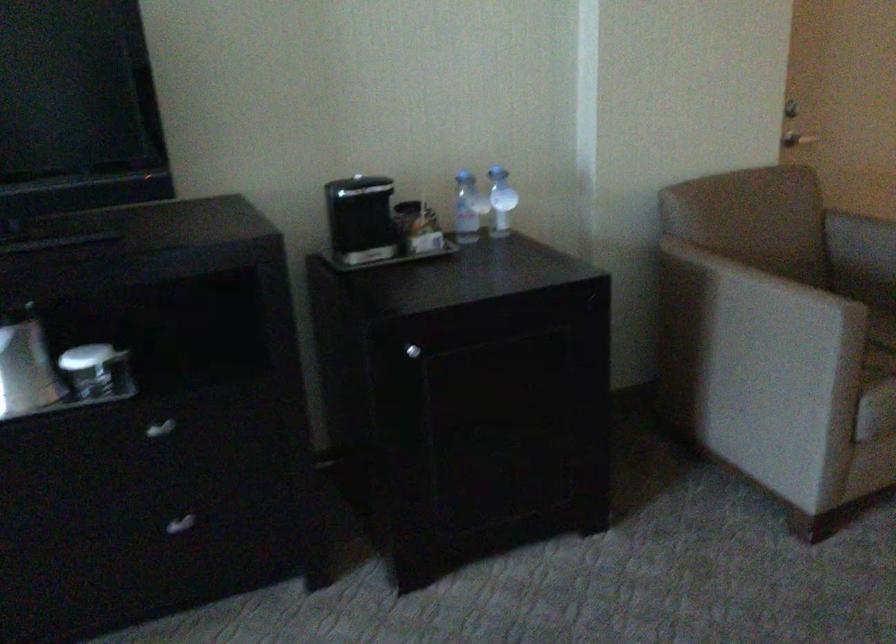
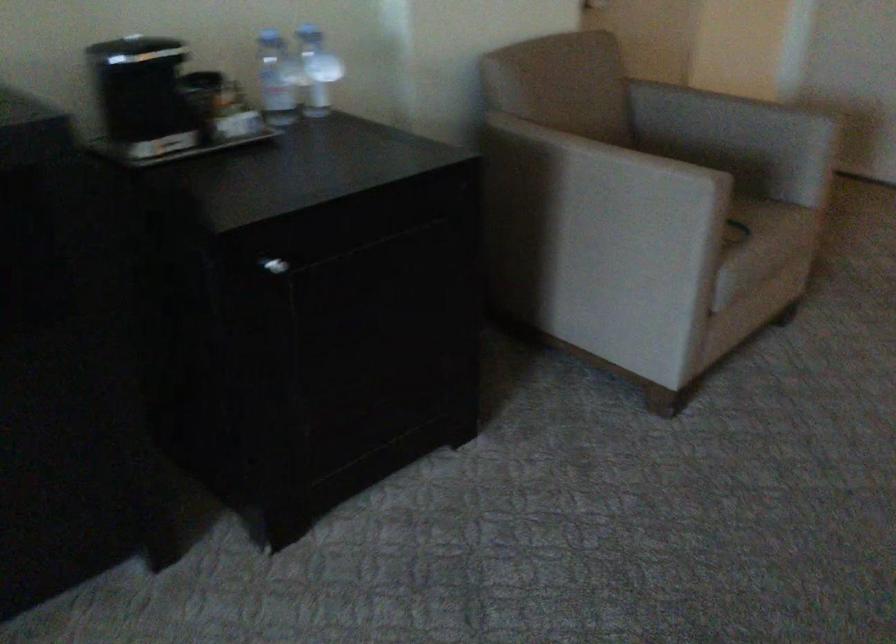
The images are taken continuously from a first-person perspective. In which direction are you moving?

The cameraman walked toward left, forward.